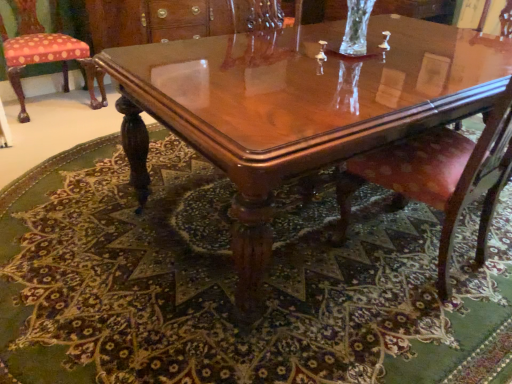
In order to click on glossy wood coffee table at center in this screenshot , I will do `click(297, 107)`.

The image size is (512, 384). What do you see at coordinates (45, 55) in the screenshot?
I see `polka dot fabric cushion at left, which ranks as the second chair in right-to-left order` at bounding box center [45, 55].

Identify the location of pink velvet chair at center, which ranks as the first chair in right-to-left order. (439, 176).

Is polka dot fabric cushion at left, the 1th chair positioned from the left, oriented away from carpeted floor at center?

No, polka dot fabric cushion at left, the 1th chair positioned from the left,'s orientation is not away from carpeted floor at center.

From a real-world perspective, which is physically above, polka dot fabric cushion at left, the 1th chair positioned from the left, or carpeted floor at center?

polka dot fabric cushion at left, the 1th chair positioned from the left.

Can carpeted floor at center be found inside polka dot fabric cushion at left, the 2th chair from the front?

No.

Is point (78, 44) behind point (196, 302)?

Yes, point (78, 44) is behind point (196, 302).

Would you say pink velvet chair at center, arranged as the 1th chair when ordered from the bottom, contains polka dot fabric cushion at left, the 2th chair from the front?

No.

Can you see pink velvet chair at center, acting as the second chair starting from the left, touching polka dot fabric cushion at left, which ranks as the second chair in right-to-left order?

They are not placed beside each other.

Is pink velvet chair at center, acting as the first chair starting from the front, taller or shorter than polka dot fabric cushion at left, the 2th chair from the front?

Considering their sizes, pink velvet chair at center, acting as the first chair starting from the front, has more height than polka dot fabric cushion at left, the 2th chair from the front.

How different are the orientations of carpeted floor at center and glossy wood coffee table at center in degrees?

The facing directions of carpeted floor at center and glossy wood coffee table at center are 1.02 degrees apart.

Is glossy wood coffee table at center at the back of carpeted floor at center?

No, carpeted floor at center's orientation is not away from glossy wood coffee table at center.

Between carpeted floor at center and glossy wood coffee table at center, which one has larger width?

With larger width is carpeted floor at center.

Find the location of a particular element. coffee table located above the carpeted floor at center (from the image's perspective) is located at coordinates (297, 107).

Are carpeted floor at center and pink velvet chair at center, which ranks as the first chair in right-to-left order, located far from each other?

carpeted floor at center is near pink velvet chair at center, which ranks as the first chair in right-to-left order, not far away.

In the image, is carpeted floor at center on the left side or the right side of pink velvet chair at center, arranged as the 1th chair when ordered from the bottom?

Based on their positions, carpeted floor at center is located to the left of pink velvet chair at center, arranged as the 1th chair when ordered from the bottom.

From the image's perspective, does carpeted floor at center appear lower than pink velvet chair at center, acting as the first chair starting from the front?

Indeed, from the image's perspective, carpeted floor at center is shown beneath pink velvet chair at center, acting as the first chair starting from the front.

From a real-world perspective, who is located higher, carpeted floor at center or pink velvet chair at center, acting as the first chair starting from the front?

In real-world perspective, pink velvet chair at center, acting as the first chair starting from the front, is above.

Can you confirm if carpeted floor at center is thinner than polka dot fabric cushion at left, marked as the 1th chair in a top-to-bottom arrangement?

No.

Can you tell me how much carpeted floor at center and polka dot fabric cushion at left, the 1th chair in the back-to-front sequence, differ in facing direction?

178 degrees separate the facing orientations of carpeted floor at center and polka dot fabric cushion at left, the 1th chair in the back-to-front sequence.

From a real-world perspective, is carpeted floor at center located beneath polka dot fabric cushion at left, the 1th chair in the back-to-front sequence?

Yes, from a real-world perspective, carpeted floor at center is beneath polka dot fabric cushion at left, the 1th chair in the back-to-front sequence.

Does point (42, 338) appear closer or farther from the camera than point (27, 51)?

Clearly, point (42, 338) is closer to the camera than point (27, 51).

Is pink velvet chair at center, which ranks as the first chair in right-to-left order, located outside carpeted floor at center?

Yes.

From a real-world perspective, is pink velvet chair at center, placed as the second chair when sorted from back to front, on top of carpeted floor at center?

Correct, in the physical world, pink velvet chair at center, placed as the second chair when sorted from back to front, is higher than carpeted floor at center.

Is pink velvet chair at center, acting as the first chair starting from the front, at the right side of carpeted floor at center?

Yes, pink velvet chair at center, acting as the first chair starting from the front, is to the right of carpeted floor at center.

Where is `mat located underneath the pink velvet chair at center, which ranks as the first chair in right-to-left order (from a real-world perspective)`? Image resolution: width=512 pixels, height=384 pixels. mat located underneath the pink velvet chair at center, which ranks as the first chair in right-to-left order (from a real-world perspective) is located at coordinates (234, 284).

Is polka dot fabric cushion at left, the 1th chair in the back-to-front sequence, in contact with pink velvet chair at center, acting as the second chair starting from the left?

No, polka dot fabric cushion at left, the 1th chair in the back-to-front sequence, is not beside pink velvet chair at center, acting as the second chair starting from the left.

From the picture: Considering the sizes of objects polka dot fabric cushion at left, the 1th chair in the back-to-front sequence, and pink velvet chair at center, which ranks as the first chair in right-to-left order, in the image provided, who is smaller, polka dot fabric cushion at left, the 1th chair in the back-to-front sequence, or pink velvet chair at center, which ranks as the first chair in right-to-left order,?

Smaller between the two is polka dot fabric cushion at left, the 1th chair in the back-to-front sequence.

From the image's perspective, which is below, polka dot fabric cushion at left, the 2th chair from the front, or pink velvet chair at center, acting as the second chair starting from the left?

pink velvet chair at center, acting as the second chair starting from the left, is shown below in the image.

Find the location of a particular element. The width and height of the screenshot is (512, 384). mat below the polka dot fabric cushion at left, marked as the 1th chair in a top-to-bottom arrangement (from the image's perspective) is located at coordinates (234, 284).

The image size is (512, 384). I want to click on chair above the polka dot fabric cushion at left, the 2th chair from the front (from a real-world perspective), so click(x=439, y=176).

In the scene shown: Estimate the real-world distances between objects in this image. Which object is closer to carpeted floor at center, pink velvet chair at center, placed as the second chair when sorted from back to front, or polka dot fabric cushion at left, marked as the 1th chair in a top-to-bottom arrangement?

pink velvet chair at center, placed as the second chair when sorted from back to front.

Considering their positions, is carpeted floor at center positioned closer to pink velvet chair at center, which ranks as the first chair in right-to-left order, than glossy wood coffee table at center?

glossy wood coffee table at center.

Which object lies further to the anchor point carpeted floor at center, polka dot fabric cushion at left, which ranks as the second chair in right-to-left order, or pink velvet chair at center, acting as the second chair starting from the left?

polka dot fabric cushion at left, which ranks as the second chair in right-to-left order.

Which object lies further to the anchor point glossy wood coffee table at center, polka dot fabric cushion at left, the 1th chair positioned from the left, or pink velvet chair at center, which ranks as the first chair in right-to-left order?

The object further to glossy wood coffee table at center is polka dot fabric cushion at left, the 1th chair positioned from the left.

Considering their positions, is polka dot fabric cushion at left, which ranks as the second chair in right-to-left order, positioned closer to glossy wood coffee table at center than carpeted floor at center?

Among the two, carpeted floor at center is located nearer to glossy wood coffee table at center.

Consider the image. Estimate the real-world distances between objects in this image. Which object is closer to carpeted floor at center, glossy wood coffee table at center or polka dot fabric cushion at left, the 2th chair from the front?

Based on the image, glossy wood coffee table at center appears to be nearer to carpeted floor at center.

Looking at this image, which object lies further to the anchor point pink velvet chair at center, which appears as the 2th chair when viewed from the top, glossy wood coffee table at center or carpeted floor at center?

Among the two, carpeted floor at center is located further to pink velvet chair at center, which appears as the 2th chair when viewed from the top.

When comparing their distances from glossy wood coffee table at center, does carpeted floor at center or polka dot fabric cushion at left, the 1th chair positioned from the left, seem closer?

Based on the image, carpeted floor at center appears to be nearer to glossy wood coffee table at center.

This screenshot has height=384, width=512. In order to click on mat between polka dot fabric cushion at left, the 1th chair positioned from the left, and pink velvet chair at center, acting as the second chair starting from the left, in the horizontal direction in this screenshot , I will do `click(234, 284)`.

This screenshot has height=384, width=512. What are the coordinates of `mat situated between polka dot fabric cushion at left, marked as the 1th chair in a top-to-bottom arrangement, and glossy wood coffee table at center from left to right` in the screenshot? It's located at (x=234, y=284).

Image resolution: width=512 pixels, height=384 pixels. I want to click on coffee table located between carpeted floor at center and pink velvet chair at center, which appears as the 2th chair when viewed from the top, in the left-right direction, so click(297, 107).

This screenshot has height=384, width=512. I want to click on coffee table located between polka dot fabric cushion at left, which appears as the 2th chair when ordered from the bottom, and pink velvet chair at center, which ranks as the first chair in right-to-left order, in the left-right direction, so click(x=297, y=107).